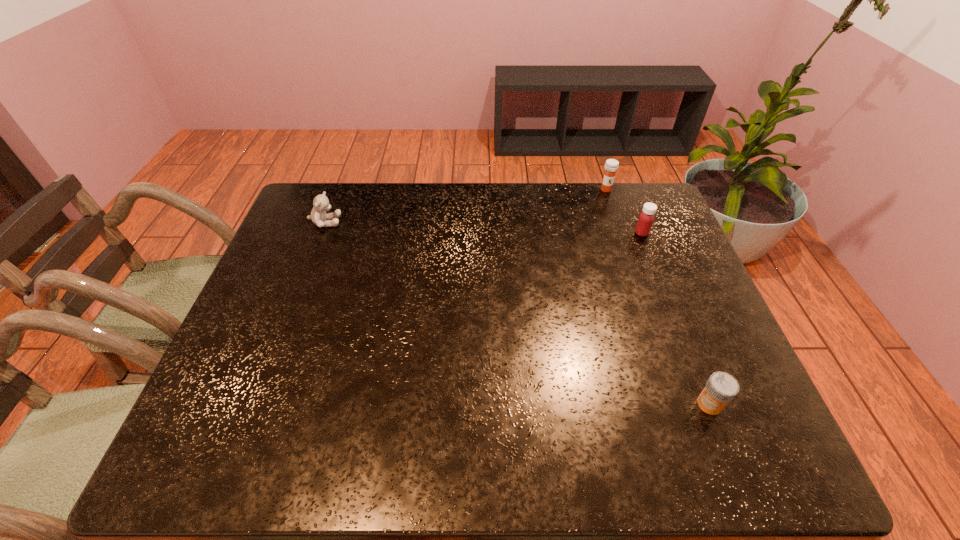
At what (x,y) coordinates should I click in order to perform the action: click on free space that satisfies the following two spatial constraints: 1. on the label side of the second farthest medicine; 2. on the right side of the farthest object. Please return your answer as a coordinate pair (x, y). This screenshot has height=540, width=960. Looking at the image, I should click on (621, 233).

This screenshot has height=540, width=960. I want to click on free location that satisfies the following two spatial constraints: 1. on the label side of the second farthest medicine; 2. on the right side of the second object from left to right, so click(x=621, y=233).

Identify the location of vacant region that satisfies the following two spatial constraints: 1. on the face of the leftmost object; 2. on the left side of the second farthest medicine. (322, 233).

Locate an element on the screen. Image resolution: width=960 pixels, height=540 pixels. vacant space that satisfies the following two spatial constraints: 1. on the label side of the farthest object; 2. on the face of the teddy bear is located at coordinates click(x=617, y=222).